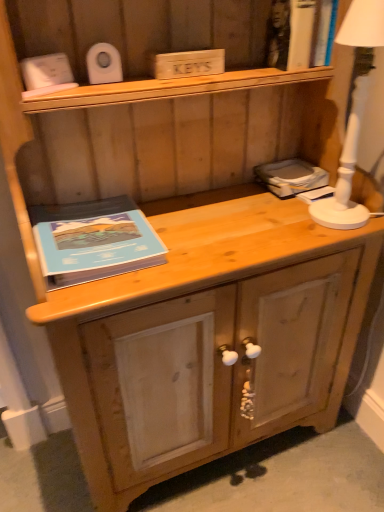
Question: From a real-world perspective, is blue matte book at left beneath matte gray book at right?

Choices:
 (A) yes
 (B) no

Answer: (A)

Question: Is matte gray book at right located within blue matte book at left?

Choices:
 (A) yes
 (B) no

Answer: (B)

Question: From the image's perspective, is blue matte book at left under matte gray book at right?

Choices:
 (A) yes
 (B) no

Answer: (A)

Question: Is blue matte book at left outside of matte gray book at right?

Choices:
 (A) no
 (B) yes

Answer: (B)

Question: Does blue matte book at left have a lesser width compared to matte gray book at right?

Choices:
 (A) yes
 (B) no

Answer: (B)

Question: Is white ceramic lamp at right in front of or behind natural wood drawer at lower center in the image?

Choices:
 (A) front
 (B) behind

Answer: (A)

Question: In terms of height, does white ceramic lamp at right look taller or shorter compared to natural wood drawer at lower center?

Choices:
 (A) tall
 (B) short

Answer: (A)

Question: Visually, is white ceramic lamp at right positioned to the left or to the right of natural wood drawer at lower center?

Choices:
 (A) left
 (B) right

Answer: (B)

Question: Is white ceramic lamp at right situated inside natural wood drawer at lower center or outside?

Choices:
 (A) outside
 (B) inside

Answer: (A)

Question: Visually, is matte gray book at right positioned to the left or to the right of white ceramic lamp at right?

Choices:
 (A) right
 (B) left

Answer: (B)

Question: From a real-world perspective, relative to white ceramic lamp at right, is matte gray book at right vertically above or below?

Choices:
 (A) below
 (B) above

Answer: (A)

Question: Do you think matte gray book at right is within white ceramic lamp at right, or outside of it?

Choices:
 (A) inside
 (B) outside

Answer: (B)

Question: In terms of size, does matte gray book at right appear bigger or smaller than white ceramic lamp at right?

Choices:
 (A) big
 (B) small

Answer: (B)

Question: From the image's perspective, is natural wood drawer at lower center located above or below white ceramic lamp at right?

Choices:
 (A) below
 (B) above

Answer: (A)

Question: From their relative heights in the image, would you say natural wood drawer at lower center is taller or shorter than white ceramic lamp at right?

Choices:
 (A) tall
 (B) short

Answer: (B)